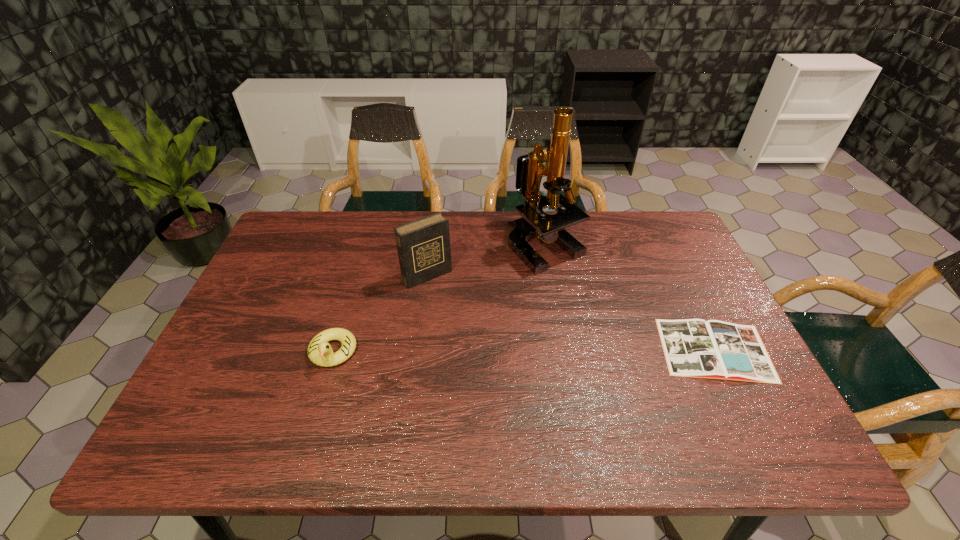
Where is `blank space at the right edge of the desktop`? blank space at the right edge of the desktop is located at coordinates (676, 297).

In the image, there is a desktop. Identify the location of free space at the far left corner. click(299, 254).

Identify the location of vacant area at the near left corner of the desktop. The image size is (960, 540). (228, 410).

Where is `free location at the far right corner of the desktop`? This screenshot has height=540, width=960. free location at the far right corner of the desktop is located at coordinates (636, 212).

What are the coordinates of `vacant area that lies between the duckling and the second object from left to right` in the screenshot? It's located at (380, 314).

Find the location of a particular element. free space that is in between the third object from right to left and the tallest object is located at coordinates (487, 260).

Locate an element on the screen. This screenshot has height=540, width=960. free spot between the duckling and the book is located at coordinates (523, 350).

Image resolution: width=960 pixels, height=540 pixels. Find the location of `empty space that is in between the duckling and the book`. empty space that is in between the duckling and the book is located at coordinates (x=523, y=350).

The width and height of the screenshot is (960, 540). In order to click on vacant region between the second object from left to right and the third tallest object in this screenshot , I will do `click(380, 314)`.

Identify the location of free space between the second shortest object and the rightmost object. (523, 350).